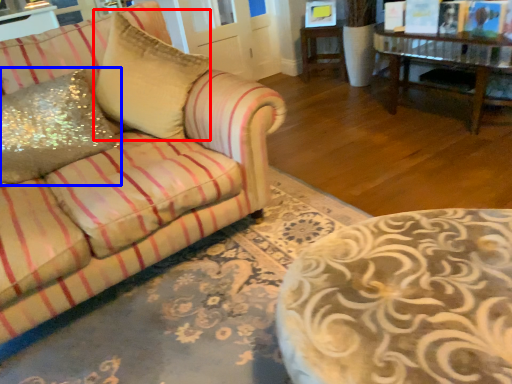
Question: Which object appears farthest to the camera in this image, throw pillow (highlighted by a red box) or throw pillow (highlighted by a blue box)?

Choices:
 (A) throw pillow
 (B) throw pillow

Answer: (A)